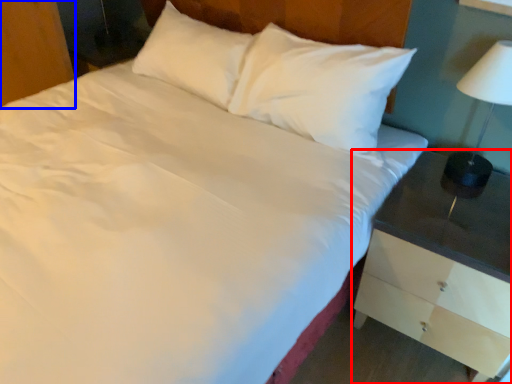
Question: Which object is further to the camera taking this photo, nightstand (highlighted by a red box) or dresser (highlighted by a blue box)?

Choices:
 (A) nightstand
 (B) dresser

Answer: (B)